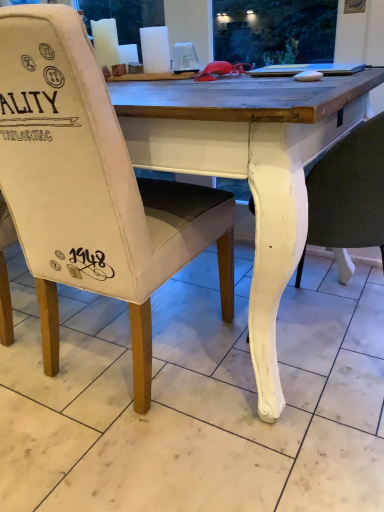
In order to click on canvas chair at center, acting as the first chair starting from the left in this screenshot , I will do (x=91, y=188).

Considering the relative sizes of white painted wood chair at lower right, which appears as the first chair when viewed from the right, and canvas chair at center, placed as the second chair when sorted from right to left, in the image provided, is white painted wood chair at lower right, which appears as the first chair when viewed from the right, bigger than canvas chair at center, placed as the second chair when sorted from right to left,?

Actually, white painted wood chair at lower right, which appears as the first chair when viewed from the right, might be smaller than canvas chair at center, placed as the second chair when sorted from right to left.

From a real-world perspective, is white painted wood chair at lower right, which appears as the first chair when viewed from the right, physically below canvas chair at center, acting as the first chair starting from the left?

Yes, from a real-world perspective, white painted wood chair at lower right, which appears as the first chair when viewed from the right, is below canvas chair at center, acting as the first chair starting from the left.

Can you tell me how much white painted wood chair at lower right, placed as the second chair when sorted from left to right, and canvas chair at center, acting as the first chair starting from the left, differ in facing direction?

white painted wood chair at lower right, placed as the second chair when sorted from left to right, and canvas chair at center, acting as the first chair starting from the left, are facing 90 degrees away from each other.

From the image's perspective, which object appears higher, white painted wood chair at lower right, placed as the second chair when sorted from left to right, or canvas chair at center, acting as the first chair starting from the left?

canvas chair at center, acting as the first chair starting from the left, appears higher in the image.

Is canvas chair at center, placed as the second chair when sorted from right to left, spatially inside white marble tile at lower center, or outside of it?

The correct answer is: outside.

In the scene shown: Is canvas chair at center, acting as the first chair starting from the left, at the left side of white marble tile at lower center?

Indeed, canvas chair at center, acting as the first chair starting from the left, is positioned on the left side of white marble tile at lower center.

Is canvas chair at center, placed as the second chair when sorted from right to left, with white marble tile at lower center?

No, canvas chair at center, placed as the second chair when sorted from right to left, is not with white marble tile at lower center.

Looking at this image, is white painted wood chair at lower right, placed as the second chair when sorted from left to right, at the back of canvas chair at center, acting as the first chair starting from the left?

That's not correct — canvas chair at center, acting as the first chair starting from the left, is not looking away from white painted wood chair at lower right, placed as the second chair when sorted from left to right.

From a real-world perspective, is canvas chair at center, acting as the first chair starting from the left, below white painted wood chair at lower right, which appears as the first chair when viewed from the right?

No.

Find the location of a particular element. The width and height of the screenshot is (384, 512). chair that is on the left side of white painted wood chair at lower right, which appears as the first chair when viewed from the right is located at coordinates (91, 188).

Is canvas chair at center, placed as the second chair when sorted from right to left, thinner than white painted wood chair at lower right, which appears as the first chair when viewed from the right?

In fact, canvas chair at center, placed as the second chair when sorted from right to left, might be wider than white painted wood chair at lower right, which appears as the first chair when viewed from the right.

In the scene shown: From a real-world perspective, which is physically above, white painted wood chair at lower right, which appears as the first chair when viewed from the right, or white marble tile at lower center?

From a 3D spatial view, white painted wood chair at lower right, which appears as the first chair when viewed from the right, is above.

Based on the photo, which object is thinner, white painted wood chair at lower right, which appears as the first chair when viewed from the right, or white marble tile at lower center?

white painted wood chair at lower right, which appears as the first chair when viewed from the right.

Is white painted wood chair at lower right, placed as the second chair when sorted from left to right, surrounding white marble tile at lower center?

No, white marble tile at lower center is located outside of white painted wood chair at lower right, placed as the second chair when sorted from left to right.

Considering the relative sizes of white marble tile at lower center and white painted wood chair at lower right, which appears as the first chair when viewed from the right, in the image provided, is white marble tile at lower center shorter than white painted wood chair at lower right, which appears as the first chair when viewed from the right,?

Yes, white marble tile at lower center is shorter than white painted wood chair at lower right, which appears as the first chair when viewed from the right.

Is white marble tile at lower center not within white painted wood chair at lower right, placed as the second chair when sorted from left to right?

Yes, white marble tile at lower center is not within white painted wood chair at lower right, placed as the second chair when sorted from left to right.

Which is in front, point (132, 483) or point (374, 141)?

Positioned in front is point (374, 141).

Would you consider white marble tile at lower center to be distant from canvas chair at center, placed as the second chair when sorted from right to left?

No, white marble tile at lower center is not far from canvas chair at center, placed as the second chair when sorted from right to left.

From the picture: How different are the orientations of white marble tile at lower center and canvas chair at center, acting as the first chair starting from the left, in degrees?

89.9 degrees separate the facing orientations of white marble tile at lower center and canvas chair at center, acting as the first chair starting from the left.

From the image's perspective, starting from the white marble tile at lower center, which chair is the 2nd one above? Please provide its 2D coordinates.

[(91, 188)]

Is white marble tile at lower center positioned in front of canvas chair at center, acting as the first chair starting from the left?

Yes.

In order to click on chair lying on the left of white painted wood chair at lower right, which appears as the first chair when viewed from the right in this screenshot , I will do `click(91, 188)`.

Starting from the white marble tile at lower center, which chair is the 1st one behind? Please provide its 2D coordinates.

[(91, 188)]

Estimate the real-world distances between objects in this image. Which object is further from white painted wood chair at lower right, placed as the second chair when sorted from left to right, white marble tile at lower center or canvas chair at center, acting as the first chair starting from the left?

white marble tile at lower center lies further to white painted wood chair at lower right, placed as the second chair when sorted from left to right, than the other object.

Estimate the real-world distances between objects in this image. Which object is closer to white marble tile at lower center, white painted wood chair at lower right, placed as the second chair when sorted from left to right, or canvas chair at center, acting as the first chair starting from the left?

canvas chair at center, acting as the first chair starting from the left, is positioned closer to the anchor white marble tile at lower center.

When comparing their distances from canvas chair at center, acting as the first chair starting from the left, does white painted wood chair at lower right, placed as the second chair when sorted from left to right, or white marble tile at lower center seem closer?

The object closer to canvas chair at center, acting as the first chair starting from the left, is white marble tile at lower center.

Based on their spatial positions, is white marble tile at lower center or white painted wood chair at lower right, which appears as the first chair when viewed from the right, further from canvas chair at center, acting as the first chair starting from the left?

white painted wood chair at lower right, which appears as the first chair when viewed from the right, is positioned further to the anchor canvas chair at center, acting as the first chair starting from the left.

Looking at the image, which one is located closer to white marble tile at lower center, canvas chair at center, acting as the first chair starting from the left, or white painted wood chair at lower right, which appears as the first chair when viewed from the right?

canvas chair at center, acting as the first chair starting from the left, is closer to white marble tile at lower center.

Looking at this image, which object lies nearer to the anchor point white painted wood chair at lower right, which appears as the first chair when viewed from the right, canvas chair at center, acting as the first chair starting from the left, or white marble tile at lower center?

canvas chair at center, acting as the first chair starting from the left, lies closer to white painted wood chair at lower right, which appears as the first chair when viewed from the right, than the other object.

The image size is (384, 512). I want to click on tile between canvas chair at center, placed as the second chair when sorted from right to left, and white painted wood chair at lower right, placed as the second chair when sorted from left to right, from left to right, so click(x=197, y=399).